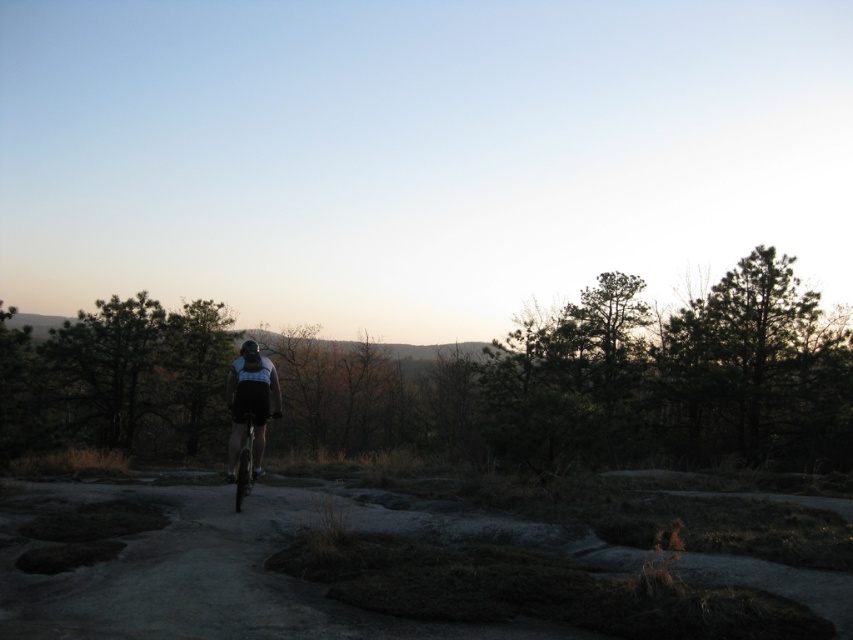
You are a cyclist planning to ride along the dull gray dirt track at center. Considering the width of the matte black shorts at center, do you think the track is wide enough for safe passage?

The dull gray dirt track at center is wider than the matte black shorts at center, so it should be wide enough for safe passage.

You are a photographer aiming to capture the cyclist from behind without including the metallic silver bicycle at center in the shot. Is it possible to frame the matte black shorts at center without the bicycle?

The matte black shorts at center is positioned under the metallic silver bicycle at center, so it would be challenging to capture the shorts without including the bicycle in the frame.

You are a photographer trying to capture the cyclist in the scene. Since you want to focus on the cyclist, you need to adjust your camera to ensure the metallic silver bicycle at center and the black matte helmet at center are both in sharp focus. Given their positions, which object should you set the focus point on first to ensure both are clear?

The metallic silver bicycle at center is positioned under the black matte helmet at center. To ensure both are in focus, you should set the focus point on the metallic silver bicycle at center first, as it is closer to the camera, and the helmet will naturally fall into focus due to its position above.